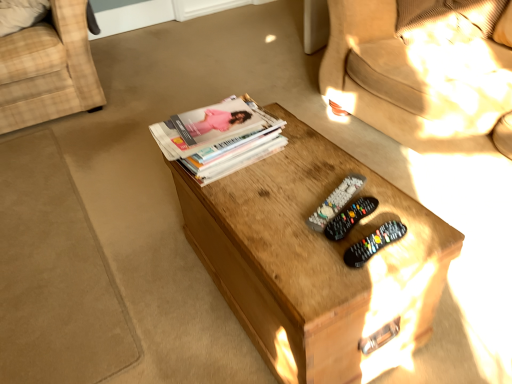
Identify the location of vacant space that is to the left of black plastic remote control at center, marked as the second remote control in a back-to-front arrangement. (280, 226).